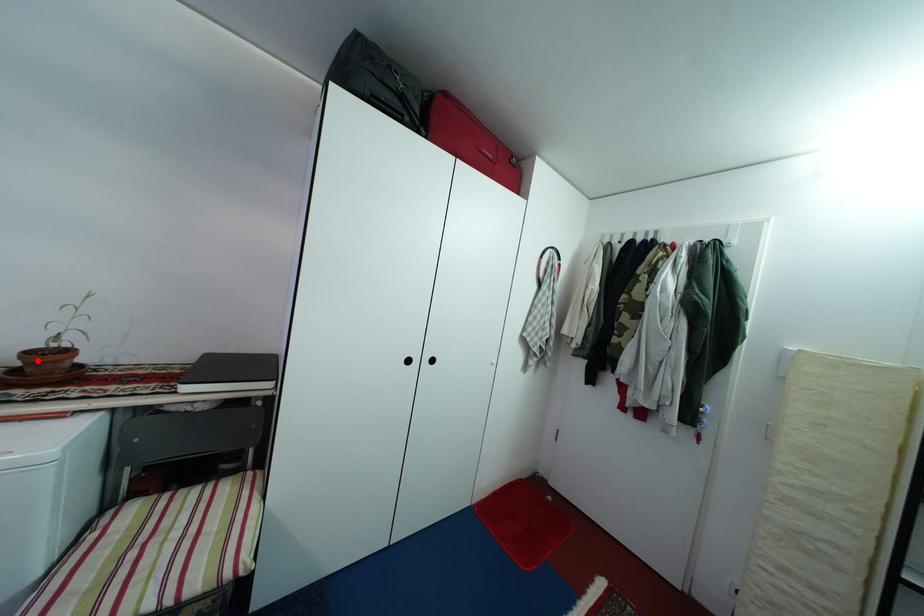
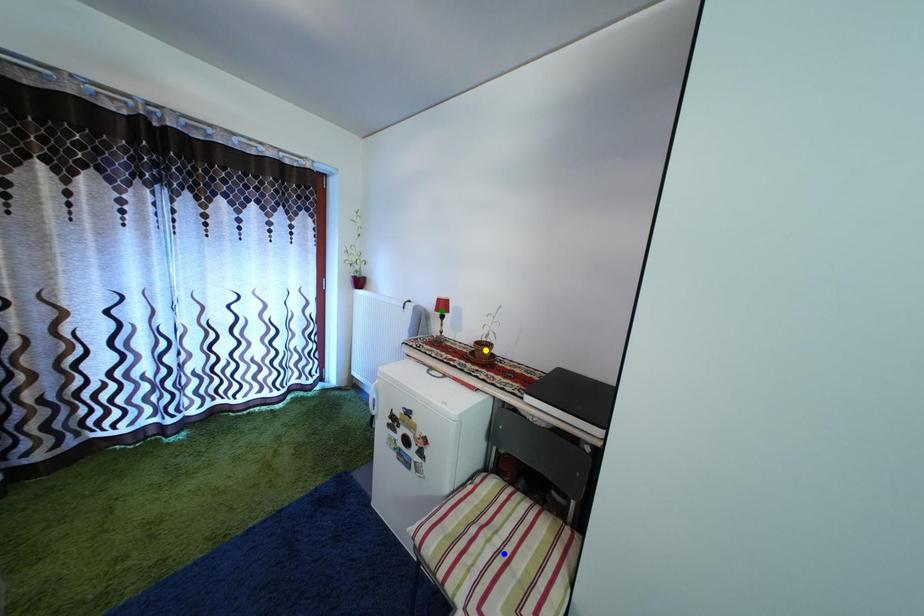
Question: I am providing you with two images of the same scene from different viewpoints. A red point is marked on the first image. You are given multiple points on the second image. In image 2, which mark is for the same physical point as the one in image 1?

Choices:
 (A) yellow point
 (B) blue point
 (C) green point

Answer: (A)